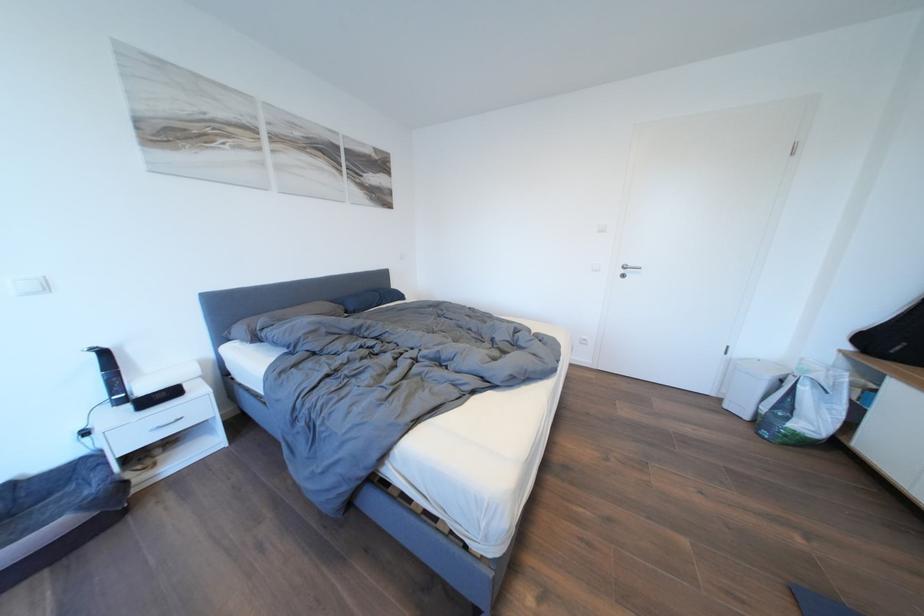
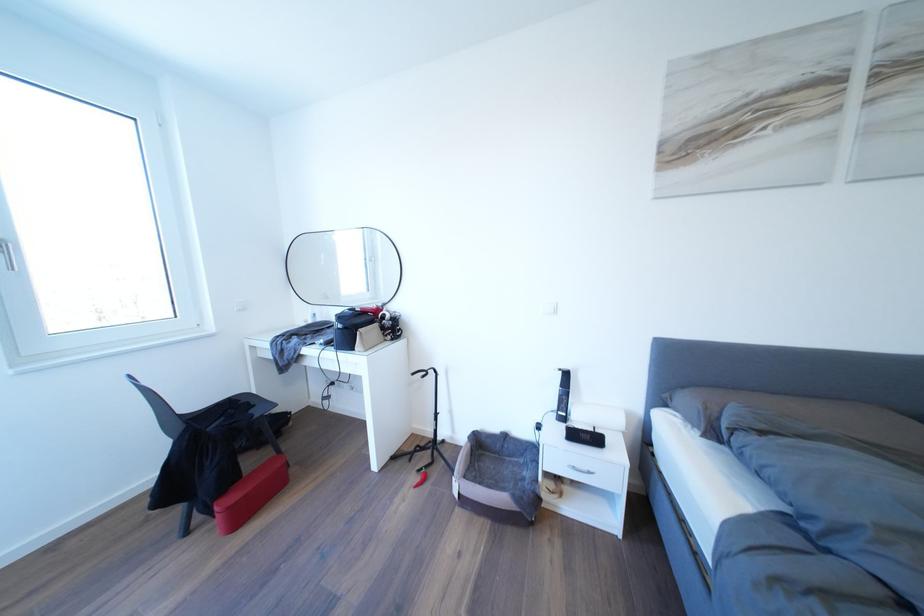
Question: How did the camera likely rotate?

Choices:
 (A) Left
 (B) Right
 (C) Up
 (D) Down

Answer: (A)